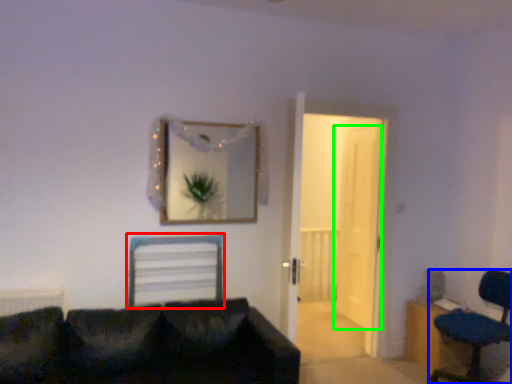
Question: Which is nearer to the computer chair (highlighted by a red box)? chair (highlighted by a blue box) or door (highlighted by a green box).

Choices:
 (A) chair
 (B) door

Answer: (B)